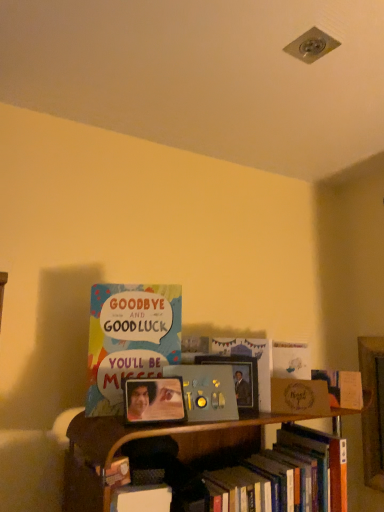
Question: Considering the relative sizes of matte wooden picture frame at center and matte gold card at right in the image provided, is matte wooden picture frame at center smaller than matte gold card at right?

Choices:
 (A) yes
 (B) no

Answer: (A)

Question: From a real-world perspective, is matte wooden picture frame at center located higher than matte gold card at right?

Choices:
 (A) yes
 (B) no

Answer: (A)

Question: From the image's perspective, is matte wooden picture frame at center located above matte gold card at right?

Choices:
 (A) yes
 (B) no

Answer: (A)

Question: Does matte wooden picture frame at center have a lesser width compared to matte gold card at right?

Choices:
 (A) no
 (B) yes

Answer: (B)

Question: Can you confirm if matte wooden picture frame at center is positioned to the left of matte gold card at right?

Choices:
 (A) no
 (B) yes

Answer: (B)

Question: Based on their positions, is white matte card at upper center, which ranks as the second book in top-to-bottom order, located to the left or right of hardcover book at lower right, the 1th book from the bottom?

Choices:
 (A) left
 (B) right

Answer: (B)

Question: Would you say white matte card at upper center, placed as the 4th book when sorted from bottom to top, is inside or outside hardcover book at lower right, the fifth book positioned from the top?

Choices:
 (A) outside
 (B) inside

Answer: (A)

Question: In the image, is white matte card at upper center, placed as the 4th book when sorted from bottom to top, positioned in front of or behind hardcover book at lower right, the fifth book positioned from the top?

Choices:
 (A) behind
 (B) front

Answer: (A)

Question: In terms of height, does white matte card at upper center, placed as the 4th book when sorted from bottom to top, look taller or shorter compared to hardcover book at lower right, the 1th book from the bottom?

Choices:
 (A) tall
 (B) short

Answer: (B)

Question: Looking at their shapes, would you say metallic silver remote control at center, which is the 3th book in top-to-bottom order, is wider or thinner than matte gold card at right?

Choices:
 (A) wide
 (B) thin

Answer: (B)

Question: From their relative heights in the image, would you say metallic silver remote control at center, which is the 3th book in bottom-to-top order, is taller or shorter than matte gold card at right?

Choices:
 (A) short
 (B) tall

Answer: (B)

Question: From the image's perspective, relative to matte gold card at right, is metallic silver remote control at center, which is the 3th book in top-to-bottom order, above or below?

Choices:
 (A) below
 (B) above

Answer: (B)

Question: From a real-world perspective, is metallic silver remote control at center, which is the 3th book in bottom-to-top order, physically located above or below matte gold card at right?

Choices:
 (A) above
 (B) below

Answer: (A)

Question: In terms of height, does metallic silver remote control at center, which is the 3th book in bottom-to-top order, look taller or shorter compared to wooden plaque at center, marked as the fourth book in a top-to-bottom arrangement?

Choices:
 (A) short
 (B) tall

Answer: (B)

Question: Is point [221, 375] positioned closer to the camera than point [350, 401]?

Choices:
 (A) farther
 (B) closer

Answer: (B)